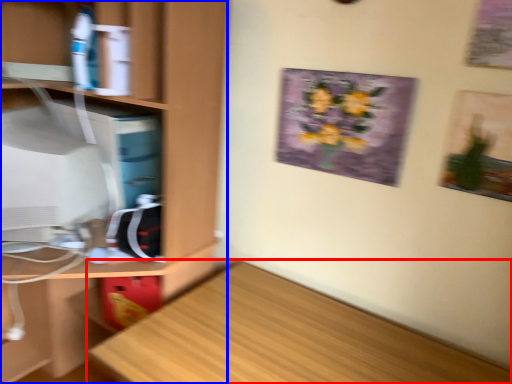
Question: Among these objects, which one is nearest to the camera, desk (highlighted by a red box) or cabinetry (highlighted by a blue box)?

Choices:
 (A) desk
 (B) cabinetry

Answer: (A)